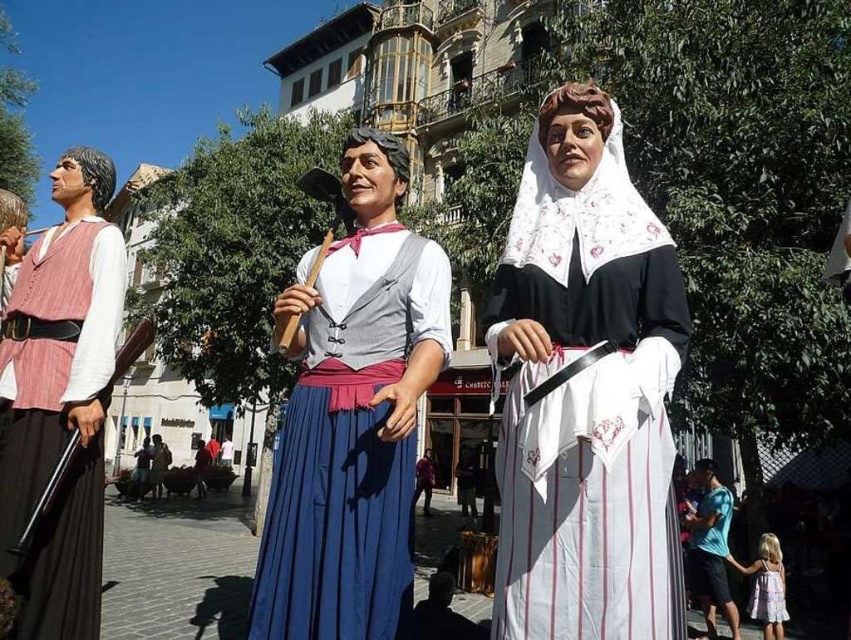
Question: Does white striped fabric at center appear on the right side of blue fabric skirt at center?

Choices:
 (A) yes
 (B) no

Answer: (A)

Question: Estimate the real-world distances between objects in this image. Which object is closer to the blue cotton t-shirt at center?

Choices:
 (A) white striped fabric at center
 (B) blue pleated skirt at center
 (C) blue fabric skirt at center
 (D) matte pink vest at left

Answer: (A)

Question: Among these points, which one is nearest to the camera?

Choices:
 (A) (295, 500)
 (B) (711, 586)

Answer: (A)

Question: Which of these objects is positioned closest to the blue cotton t-shirt at center?

Choices:
 (A) matte pink vest at left
 (B) blue pleated skirt at center

Answer: (B)

Question: Can you confirm if white striped fabric dress at center is positioned below blue fabric skirt at center?

Choices:
 (A) yes
 (B) no

Answer: (B)

Question: Does blue cotton t-shirt at center appear over blue fabric skirt at center?

Choices:
 (A) no
 (B) yes

Answer: (B)